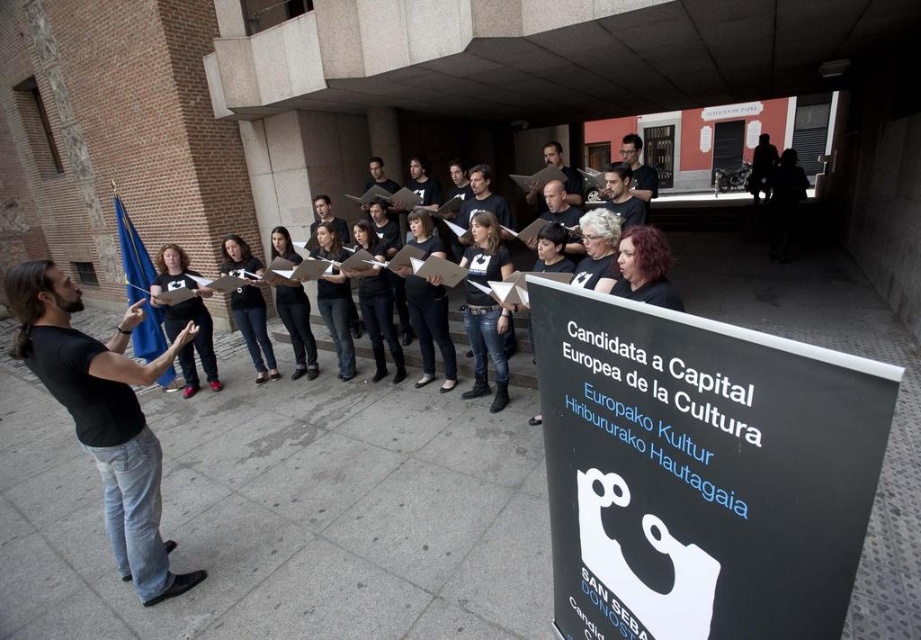
Does black matte sign at lower right appear over black cotton shirt at left?

Yes, black matte sign at lower right is above black cotton shirt at left.

Is point (589, 488) positioned after point (138, 547)?

No, it is in front of (138, 547).

Where is `black matte sign at lower right`? The height and width of the screenshot is (640, 921). black matte sign at lower right is located at coordinates (701, 472).

Who is positioned more to the left, black matte t-shirt at center or matte black shirt at center?

From the viewer's perspective, matte black shirt at center appears more on the left side.

Can you confirm if black matte t-shirt at center is thinner than matte black shirt at center?

Incorrect, black matte t-shirt at center's width is not less than matte black shirt at center's.

Identify the location of black matte t-shirt at center. (616, 259).

Based on the photo, can you confirm if black cotton shirt at left is taller than black fabric shirt at center?

Yes.

Does black cotton shirt at left come behind black fabric shirt at center?

No.

Is point (76, 342) farther from viewer compared to point (222, 244)?

No, it is in front of (222, 244).

Find the location of `black cotton shirt at left`. black cotton shirt at left is located at coordinates (102, 416).